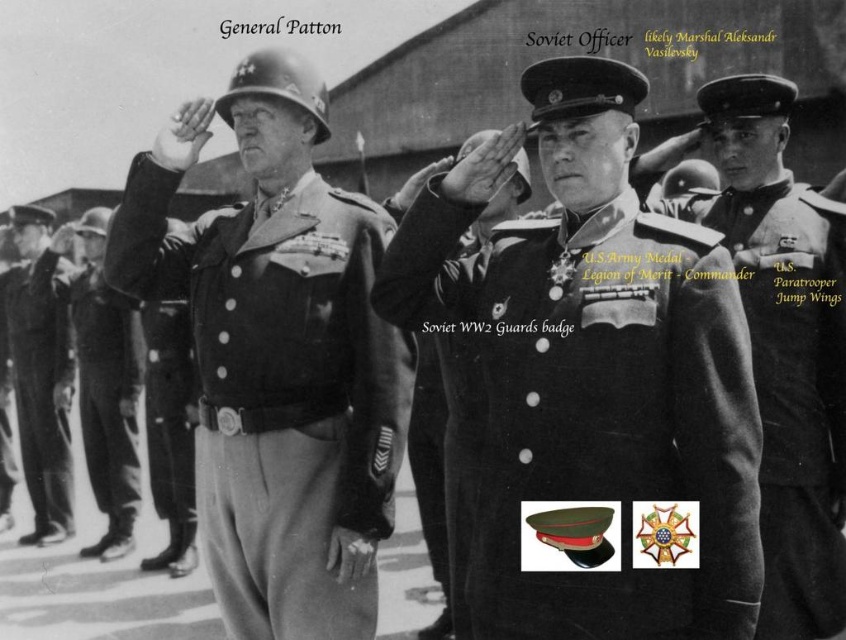
Is dark uniform at center below dark gray wool military uniform at center?

No, dark uniform at center is not below dark gray wool military uniform at center.

Does dark uniform at center appear over dark gray wool military uniform at center?

Indeed, dark uniform at center is positioned over dark gray wool military uniform at center.

Is point (551, 305) farther from camera compared to point (768, 134)?

No, (551, 305) is in front of (768, 134).

Identify the location of dark uniform at center. (585, 376).

Can you confirm if dark gray wool military uniform at center is bigger than smooth black uniform at center?

No.

Which is behind, point (757, 616) or point (26, 339)?

The point (26, 339) is more distant.

Where is `dark gray wool military uniform at center`? The width and height of the screenshot is (846, 640). dark gray wool military uniform at center is located at coordinates (781, 340).

Image resolution: width=846 pixels, height=640 pixels. Find the location of `dark gray wool military uniform at center`. dark gray wool military uniform at center is located at coordinates (781, 340).

What do you see at coordinates (585, 376) in the screenshot? I see `dark uniform at center` at bounding box center [585, 376].

Where is `dark uniform at center`? This screenshot has width=846, height=640. dark uniform at center is located at coordinates (585, 376).

Identify the location of dark uniform at center. (585, 376).